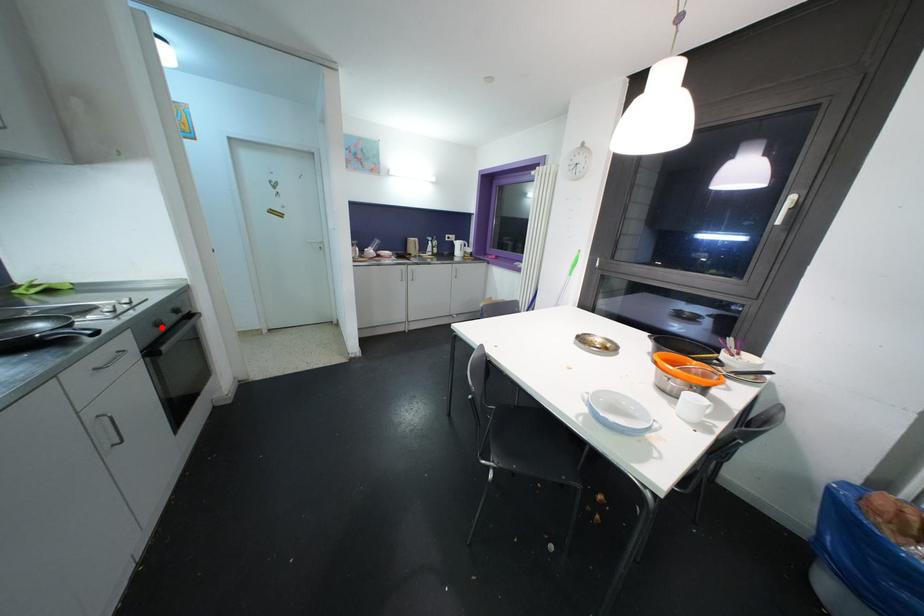
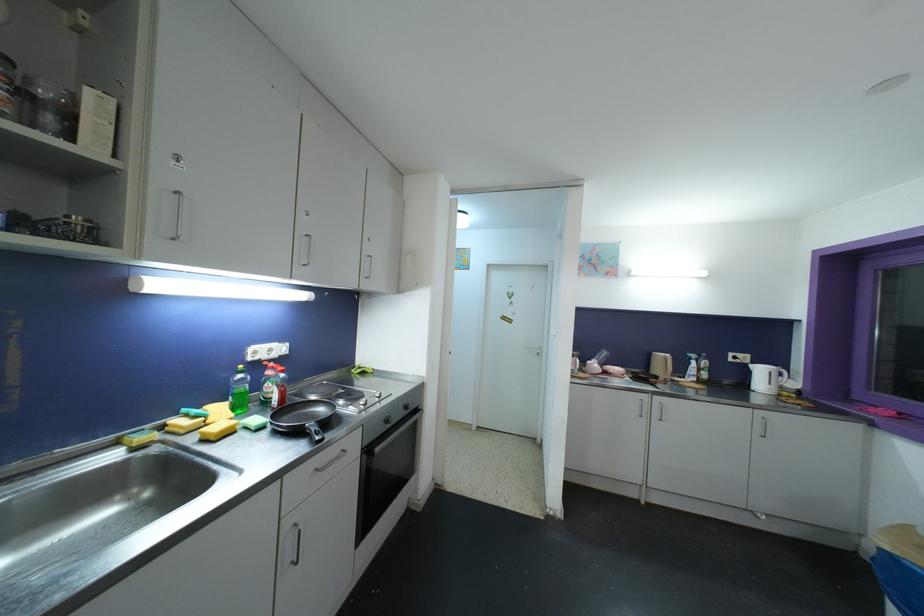
Locate, in the second image, the point that corresponds to the highlighted location in the first image.

(390, 424)